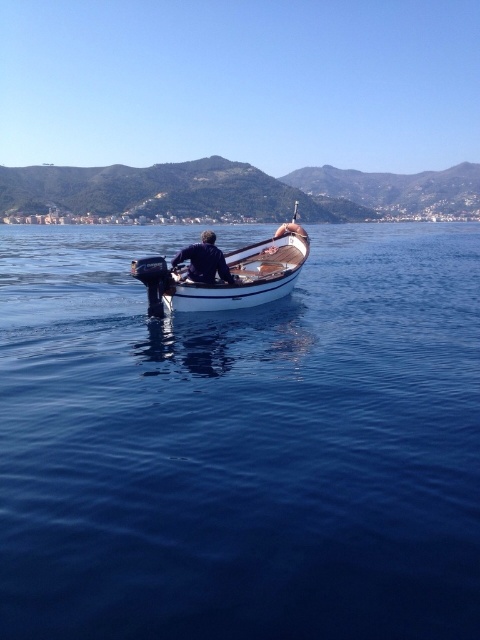
This screenshot has width=480, height=640. What do you see at coordinates (228, 275) in the screenshot?
I see `white polished wood boat at center` at bounding box center [228, 275].

Can you confirm if white polished wood boat at center is bigger than dark blue fabric at center?

Yes, white polished wood boat at center is bigger than dark blue fabric at center.

The height and width of the screenshot is (640, 480). What are the coordinates of `white polished wood boat at center` in the screenshot? It's located at (228, 275).

The height and width of the screenshot is (640, 480). Find the location of `white polished wood boat at center`. white polished wood boat at center is located at coordinates (228, 275).

Is blue smooth water at center above dark blue fabric at center?

Yes, blue smooth water at center is above dark blue fabric at center.

Which of these two, blue smooth water at center or dark blue fabric at center, stands taller?

With more height is blue smooth water at center.

Is point (252, 513) positioned behind point (175, 266)?

No, it is in front of (175, 266).

At what (x,y) coordinates should I click in order to perform the action: click on blue smooth water at center. Please return your answer as a coordinate pair (x, y). This screenshot has height=640, width=480. Looking at the image, I should click on (240, 444).

In the scene shown: Does blue smooth water at center appear on the right side of white polished wood boat at center?

Incorrect, blue smooth water at center is not on the right side of white polished wood boat at center.

Between blue smooth water at center and white polished wood boat at center, which one appears on the left side from the viewer's perspective?

blue smooth water at center is more to the left.

Where is `blue smooth water at center`? blue smooth water at center is located at coordinates (240, 444).

Where is `blue smooth water at center`? blue smooth water at center is located at coordinates (240, 444).